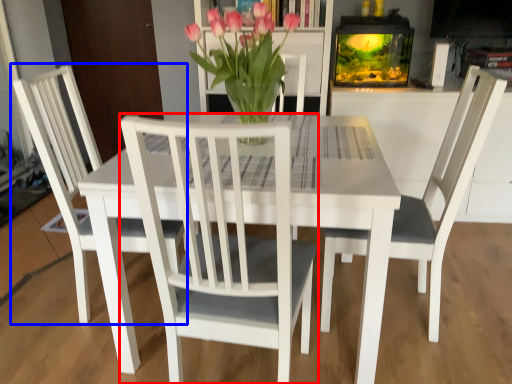
Question: Which object appears closest to the camera in this image, chair (highlighted by a red box) or chair (highlighted by a blue box)?

Choices:
 (A) chair
 (B) chair

Answer: (A)